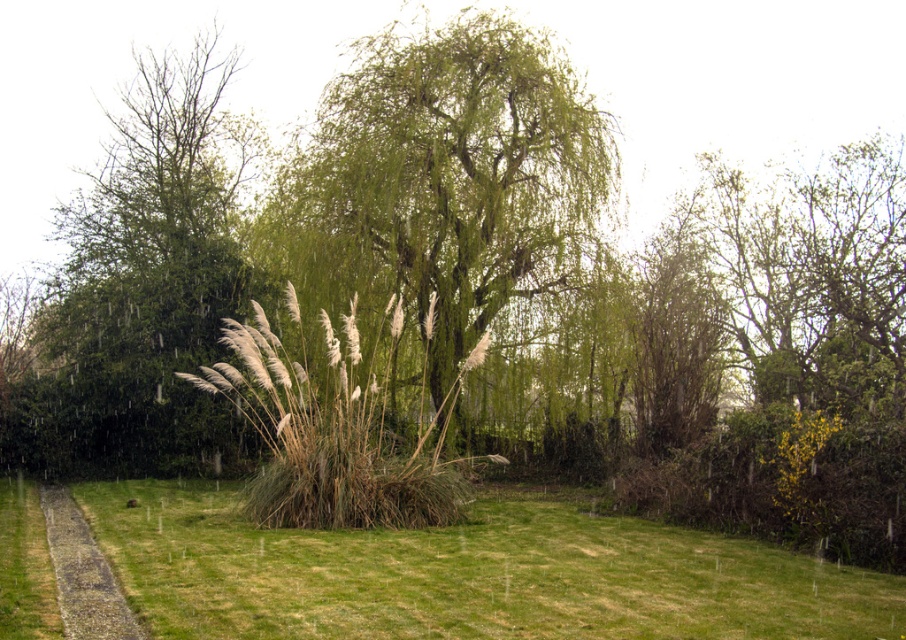
Who is shorter, green grass at center or green leafy tree at left?

Standing shorter between the two is green grass at center.

Can you confirm if green grass at center is wider than green leafy tree at left?

Correct, the width of green grass at center exceeds that of green leafy tree at left.

Is point (555, 516) less distant than point (20, 376)?

Yes, point (555, 516) is closer to viewer.

Locate an element on the screen. This screenshot has width=906, height=640. green grass at center is located at coordinates (467, 573).

Consider the image. Which is below, brown grassy reed at center or gravelly path at lower left?

Positioned lower is gravelly path at lower left.

Can you confirm if brown grassy reed at center is positioned above gravelly path at lower left?

Correct, brown grassy reed at center is located above gravelly path at lower left.

Describe the element at coordinates (333, 428) in the screenshot. I see `brown grassy reed at center` at that location.

I want to click on brown grassy reed at center, so click(333, 428).

Is green leafy willow at center wider than brown grassy reed at center?

Yes.

Who is taller, green leafy willow at center or brown grassy reed at center?

With more height is green leafy willow at center.

Which is behind, point (606, 132) or point (336, 355)?

Positioned behind is point (606, 132).

Locate an element on the screen. green leafy willow at center is located at coordinates (442, 188).